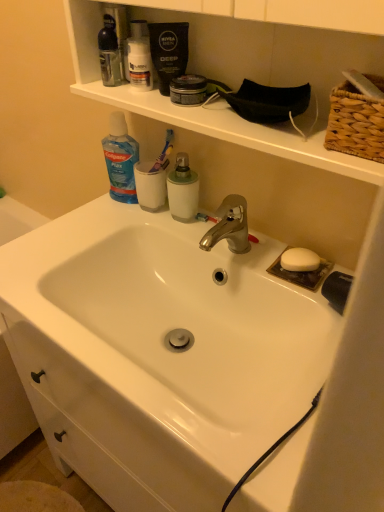
Question: In terms of height, does white glossy sink at center look taller or shorter compared to translucent plastic mouthwash at upper left, the first mouthwash positioned from the top?

Choices:
 (A) tall
 (B) short

Answer: (A)

Question: From a real-world perspective, is white glossy sink at center positioned above or below translucent plastic mouthwash at upper left, positioned as the first mouthwash in left-to-right order?

Choices:
 (A) below
 (B) above

Answer: (A)

Question: Considering the real-world distances, which object is farthest from the purple plastic toothbrush at upper center, the second toothbrush from the right?

Choices:
 (A) white glossy sink at center
 (B) blue translucent liquid at upper left
 (C) matte plastic shaving cream canister at upper center
 (D) white matte mouthwash at center, the first mouthwash from the right
 (E) red plastic toothbrush at center, which is the second toothbrush from left to right

Answer: (A)

Question: Which object is the closest to the woven straw basket at upper right?

Choices:
 (A) red plastic toothbrush at center, the first toothbrush ordered from the bottom
 (B) white matte mouthwash at center, placed as the 2th mouthwash when sorted from top to bottom
 (C) white glossy sink at center
 (D) purple plastic toothbrush at upper center, which is the first toothbrush in left-to-right order
 (E) translucent plastic mouthwash at upper left, positioned as the first mouthwash in left-to-right order

Answer: (A)